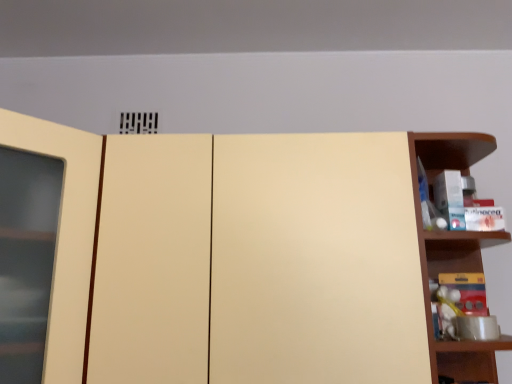
Question: Would you say matte cream cupboard at center is to the left or to the right of matte yellow toy at right in the picture?

Choices:
 (A) right
 (B) left

Answer: (B)

Question: Is point (72, 200) positioned closer to the camera than point (442, 337)?

Choices:
 (A) closer
 (B) farther

Answer: (A)

Question: Estimate the real-world distances between objects in this image. Which object is closer to the matte yellow toy at right?

Choices:
 (A) matte cream cupboard at center
 (B) wooden shelf at right

Answer: (B)

Question: Which object is the closest to the matte cream cupboard at center?

Choices:
 (A) matte yellow toy at right
 (B) wooden shelf at right

Answer: (B)